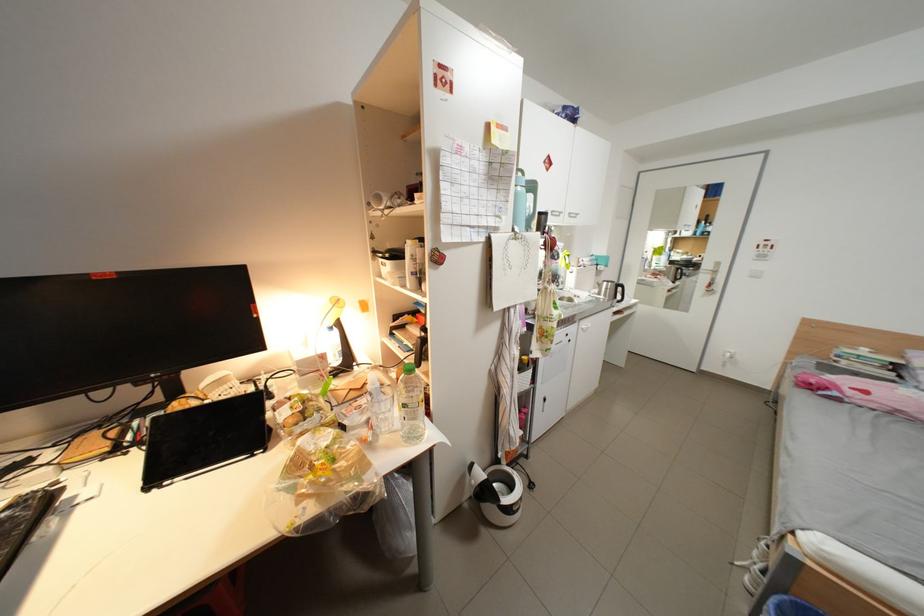
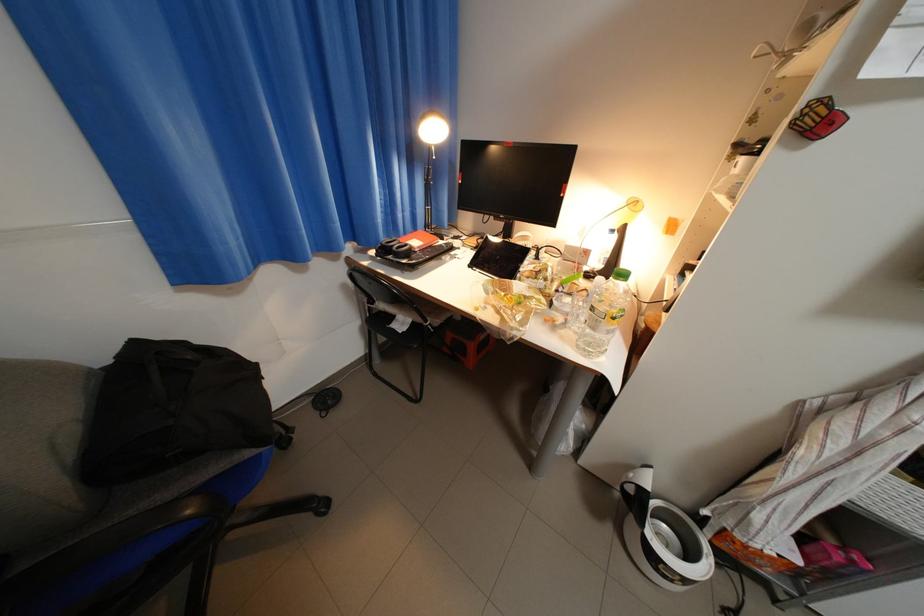
Where in the second image is the point corresponding to [532,499] from the first image?

(698, 582)